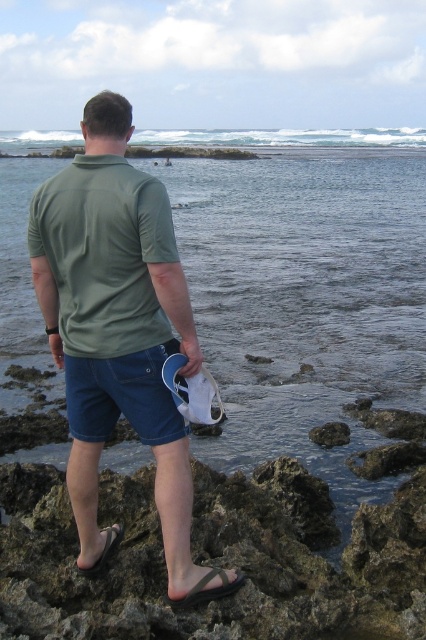
Question: Among these objects, which one is nearest to the camera?

Choices:
 (A) denim shorts at lower center
 (B) smooth gray rock at lower center
 (C) green matte shirt at center

Answer: (C)

Question: Is denim shorts at lower center wider than black rubber sandal at lower left?

Choices:
 (A) no
 (B) yes

Answer: (B)

Question: Is clear water at center bigger than green matte shirt at center?

Choices:
 (A) yes
 (B) no

Answer: (A)

Question: Among these objects, which one is nearest to the camera?

Choices:
 (A) green matte shirt at center
 (B) black rubber sandal at lower center
 (C) denim shorts at lower center

Answer: (A)

Question: Is clear water at center above denim shorts at lower center?

Choices:
 (A) no
 (B) yes

Answer: (B)

Question: Among these objects, which one is nearest to the camera?

Choices:
 (A) black rubber sandal at lower left
 (B) black rubber sandal at lower center
 (C) denim shorts at lower center
 (D) clear water at center

Answer: (B)